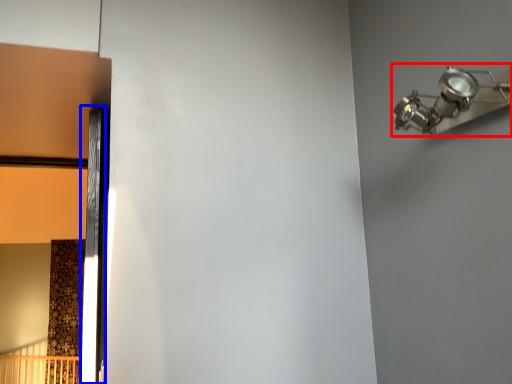
Question: Among these objects, which one is farthest to the camera, light fixture (highlighted by a red box) or door (highlighted by a blue box)?

Choices:
 (A) light fixture
 (B) door

Answer: (B)